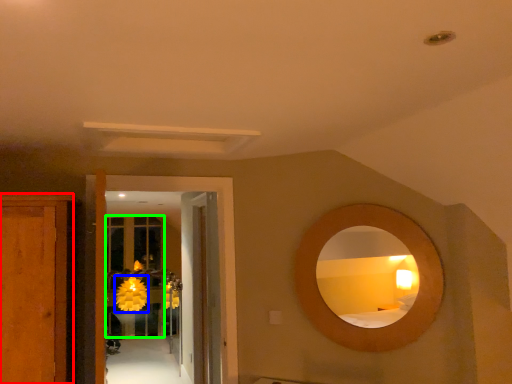
Question: Estimate the real-world distances between objects in this image. Which object is closer to cabinetry (highlighted by a red box), flower (highlighted by a blue box) or glass door (highlighted by a green box)?

Choices:
 (A) flower
 (B) glass door

Answer: (B)